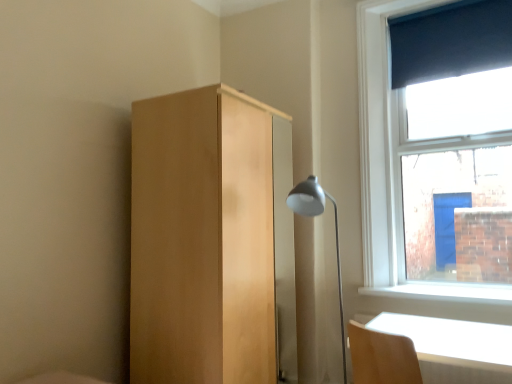
Question: Can you confirm if light wood table at lower right is positioned to the left of dark blue fabric at upper right?

Choices:
 (A) no
 (B) yes

Answer: (B)

Question: Can you confirm if light wood table at lower right is shorter than dark blue fabric at upper right?

Choices:
 (A) yes
 (B) no

Answer: (A)

Question: Is light wood table at lower right turned away from dark blue fabric at upper right?

Choices:
 (A) no
 (B) yes

Answer: (A)

Question: From a real-world perspective, does light wood table at lower right sit lower than dark blue fabric at upper right?

Choices:
 (A) no
 (B) yes

Answer: (B)

Question: Is light wood table at lower right facing towards dark blue fabric at upper right?

Choices:
 (A) no
 (B) yes

Answer: (A)

Question: Looking at the image, does light wood table at lower right seem bigger or smaller compared to dark blue fabric at upper right?

Choices:
 (A) small
 (B) big

Answer: (B)

Question: Relative to dark blue fabric at upper right, is light wood table at lower right in front or behind?

Choices:
 (A) behind
 (B) front

Answer: (B)

Question: Considering the positions of light wood table at lower right and dark blue fabric at upper right in the image, is light wood table at lower right wider or thinner than dark blue fabric at upper right?

Choices:
 (A) wide
 (B) thin

Answer: (A)

Question: Considering the positions of point (389, 332) and point (510, 3), is point (389, 332) closer or farther from the camera than point (510, 3)?

Choices:
 (A) closer
 (B) farther

Answer: (A)

Question: From the image's perspective, is light wood dresser at center above or below light wood table at lower right?

Choices:
 (A) below
 (B) above

Answer: (B)

Question: Is light wood dresser at center taller or shorter than light wood table at lower right?

Choices:
 (A) short
 (B) tall

Answer: (B)

Question: Is light wood dresser at center bigger or smaller than light wood table at lower right?

Choices:
 (A) big
 (B) small

Answer: (A)

Question: Considering their positions, is light wood dresser at center located in front of or behind light wood table at lower right?

Choices:
 (A) behind
 (B) front

Answer: (A)

Question: Is light wood table at lower right in front of or behind light wood dresser at center in the image?

Choices:
 (A) front
 (B) behind

Answer: (A)

Question: Is light wood table at lower right bigger or smaller than light wood dresser at center?

Choices:
 (A) big
 (B) small

Answer: (B)